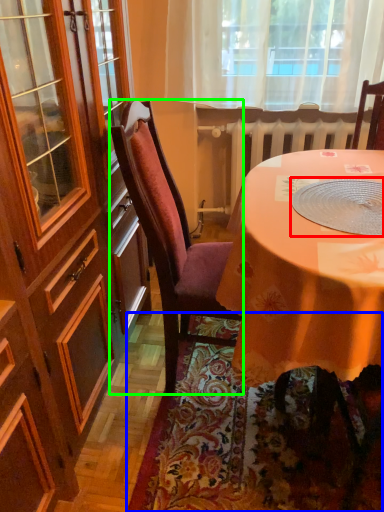
Question: Estimate the real-world distances between objects in this image. Which object is farther from tableware (highlighted by a red box), mat (highlighted by a blue box) or chair (highlighted by a green box)?

Choices:
 (A) mat
 (B) chair

Answer: (A)